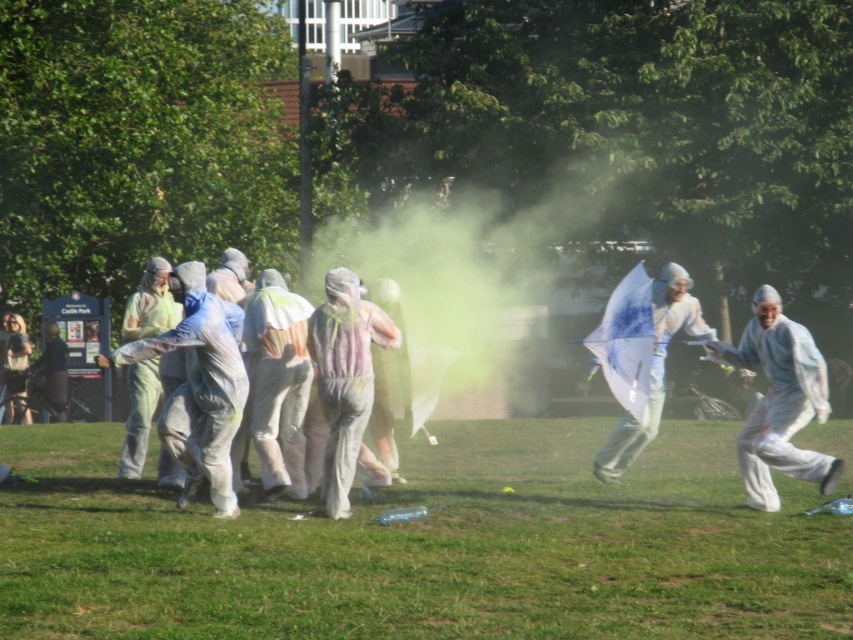
You are a photographer positioned at the center of the grassy field. You want to capture a photo of the white matte jumpsuit at right. According to the coordinates provided, in which direction should you move to frame the subject properly?

The white matte jumpsuit at right is located at coordinates point (779, 401). Since you are at the center, moving towards the right and upward direction would align the camera with the subject.